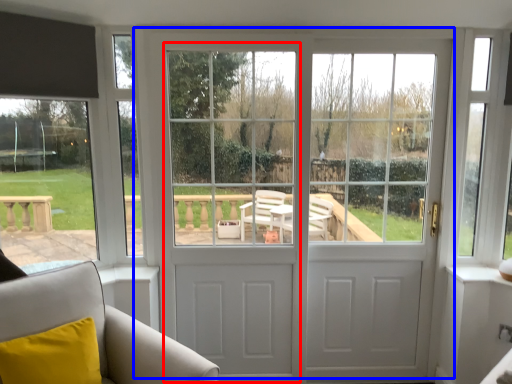
Question: Which object appears closest to the camera in this image, screen door (highlighted by a red box) or door (highlighted by a blue box)?

Choices:
 (A) screen door
 (B) door

Answer: (A)